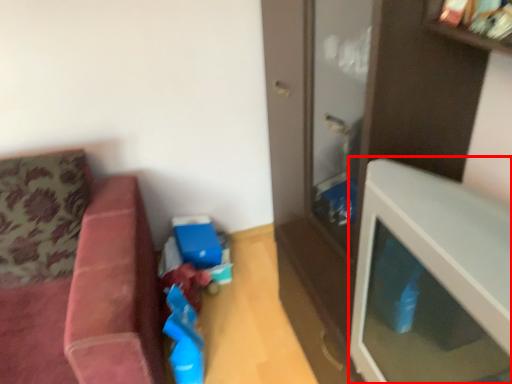
Question: Considering the relative positions of table (annotated by the red box) and studio couch in the image provided, where is table (annotated by the red box) located with respect to the staircase?

Choices:
 (A) right
 (B) left

Answer: (A)